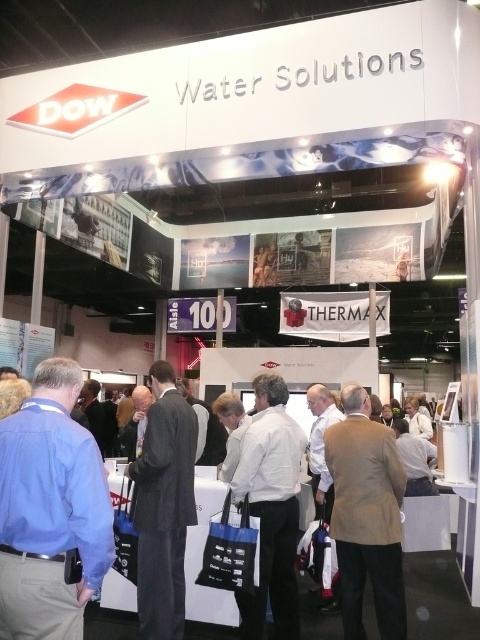
Question: Among these objects, which one is nearest to the camera?

Choices:
 (A) blue shirt at left
 (B) white matte shirt at center
 (C) dark gray suit at center

Answer: (A)

Question: Does tan fabric jacket at center appear over white matte shirt at center?

Choices:
 (A) yes
 (B) no

Answer: (A)

Question: Considering the relative positions of tan fabric jacket at center and white matte shirt at center in the image provided, where is tan fabric jacket at center located with respect to white matte shirt at center?

Choices:
 (A) above
 (B) below

Answer: (A)

Question: Which is farther from the tan fabric jacket at center?

Choices:
 (A) blue shirt at left
 (B) dark gray suit at center
 (C) white matte shirt at center

Answer: (A)

Question: Can you confirm if tan fabric jacket at center is positioned above white matte shirt at center?

Choices:
 (A) no
 (B) yes

Answer: (B)

Question: Which object appears closest to the camera in this image?

Choices:
 (A) dark gray suit at center
 (B) blue shirt at left
 (C) white matte shirt at center
 (D) tan fabric jacket at center

Answer: (B)